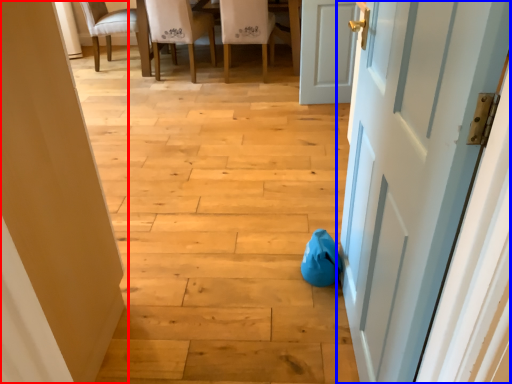
Question: Which object is closer to the camera taking this photo, door (highlighted by a red box) or door (highlighted by a blue box)?

Choices:
 (A) door
 (B) door

Answer: (B)